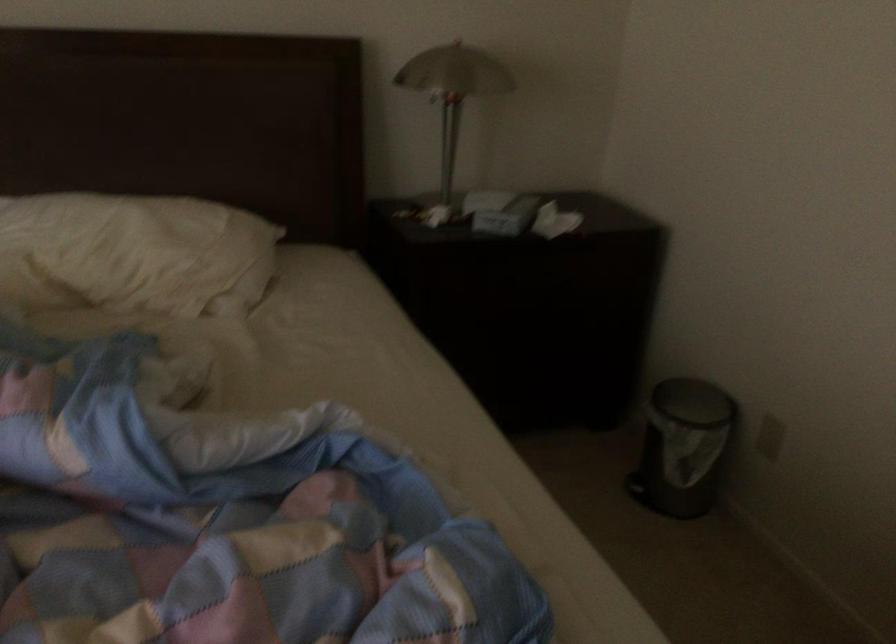
Find where to press the trash can pedal. Please return your answer as a coordinate pair (x, y).

(634, 483)